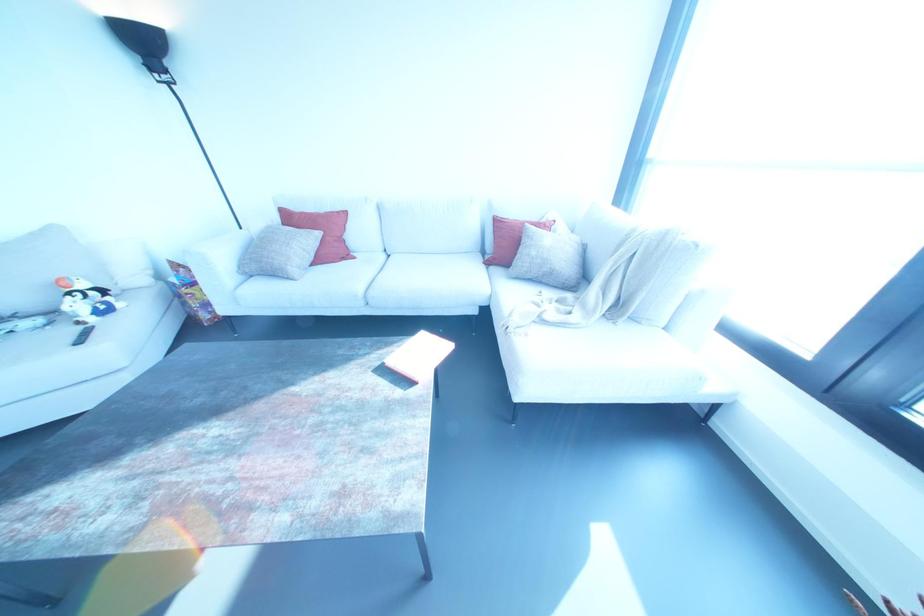
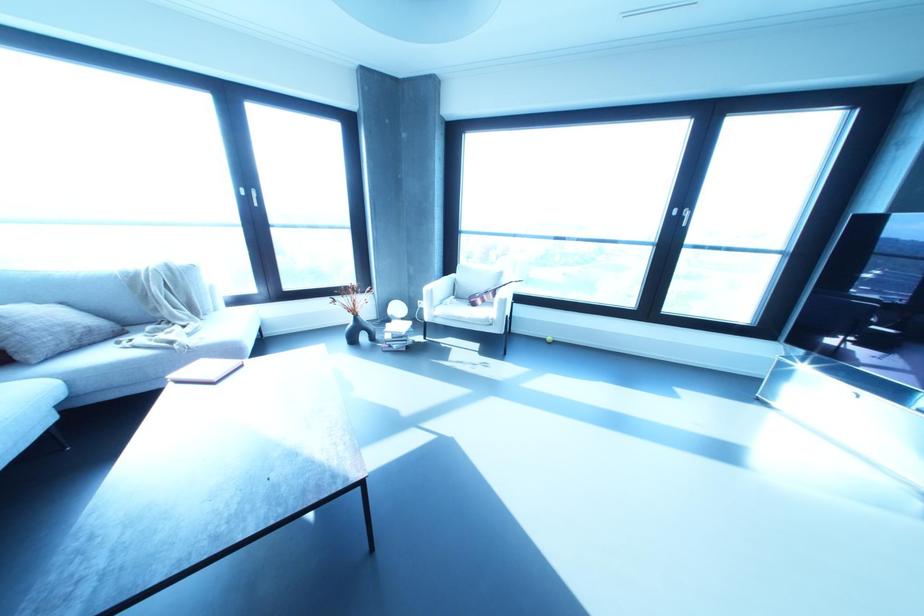
In the second image, find the point that corresponds to [551,273] in the first image.

(90, 330)